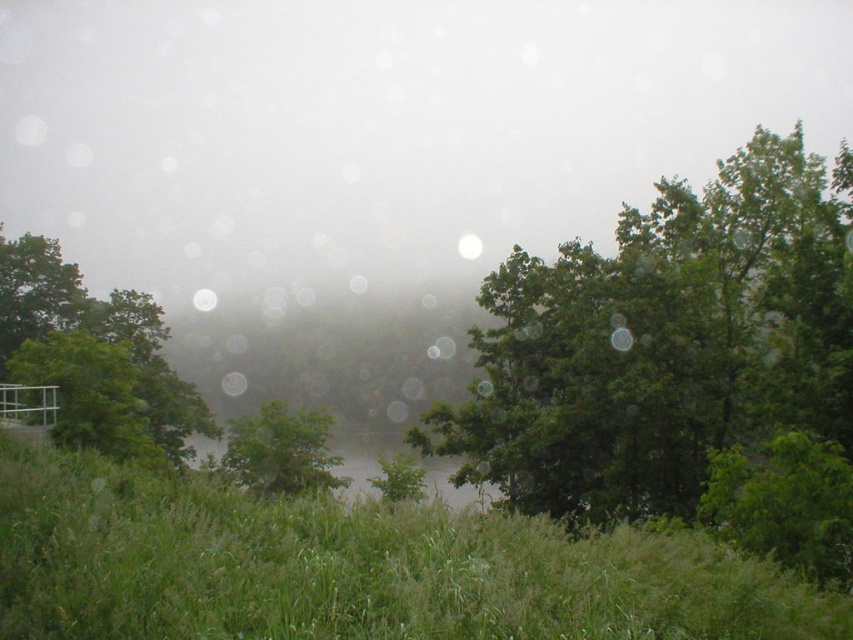
Question: Which object is positioned farthest from the green leafy tree at center?

Choices:
 (A) green grassy lake at center
 (B) green grassy field at lower center
 (C) green leafy tree at upper right
 (D) green leafy tree at left

Answer: (B)

Question: Where is green leafy tree at center located in relation to green grassy lake at center in the image?

Choices:
 (A) below
 (B) above

Answer: (B)

Question: Which object appears farthest from the camera in this image?

Choices:
 (A) green leafy tree at left
 (B) green grassy field at lower center
 (C) green leafy tree at center
 (D) green grassy lake at center

Answer: (C)

Question: Is green leafy tree at upper right bigger than green leafy tree at left?

Choices:
 (A) yes
 (B) no

Answer: (B)

Question: Can you confirm if green leafy tree at left is positioned to the right of green leafy tree at center?

Choices:
 (A) yes
 (B) no

Answer: (B)

Question: Which of the following is the closest to the observer?

Choices:
 (A) green grassy field at lower center
 (B) green leafy tree at left
 (C) green leafy tree at center

Answer: (A)